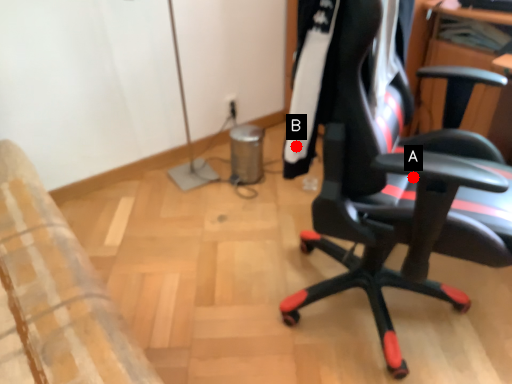
Question: Two points are circled on the image, labeled by A and B beside each circle. Which of the following is the closest to the observer?

Choices:
 (A) A is closer
 (B) B is closer

Answer: (A)